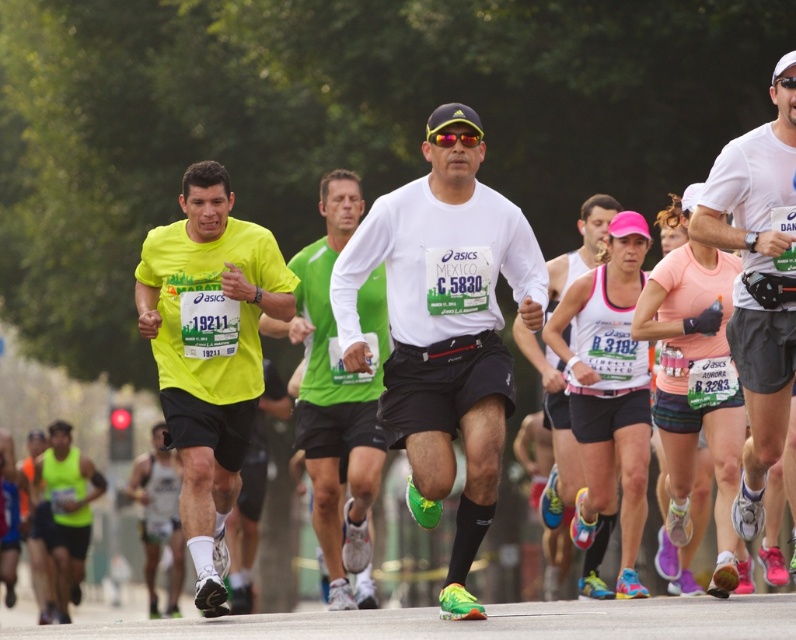
Question: Is white matte shirt at center further to the viewer compared to white matte running shirt at center?

Choices:
 (A) no
 (B) yes

Answer: (A)

Question: Which of the following is the closest to the observer?

Choices:
 (A) (755, 336)
 (B) (562, 506)
 (C) (227, 557)
 (D) (65, 550)

Answer: (A)

Question: Which object is farther from the camera taking this photo?

Choices:
 (A) white matte tank top at center
 (B) white matte running shirt at center
 (C) neon yellow t-shirt at left

Answer: (A)

Question: Is neon yellow t-shirt at left positioned before green fabric shirt at center?

Choices:
 (A) no
 (B) yes

Answer: (B)

Question: Which of the following is the farthest from the observer?

Choices:
 (A) neon yellow t-shirt at left
 (B) white matte running shirt at center
 (C) matte green tank top at lower left

Answer: (C)

Question: Does white matte shirt at center appear over white matte tank top at center?

Choices:
 (A) yes
 (B) no

Answer: (A)